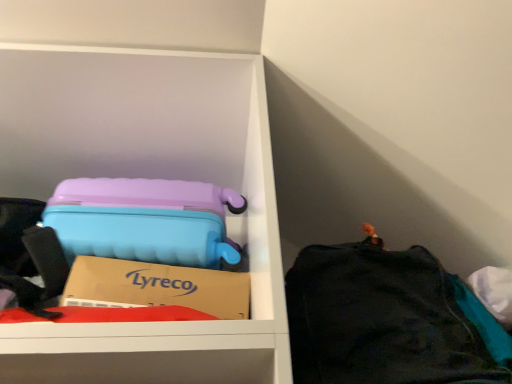
Question: Can you confirm if matte plastic suitcase at upper left is positioned to the left of black fabric bag at right?

Choices:
 (A) no
 (B) yes

Answer: (B)

Question: Is matte plastic suitcase at upper left thinner than black fabric bag at right?

Choices:
 (A) yes
 (B) no

Answer: (A)

Question: From a real-world perspective, is matte plastic suitcase at upper left on top of black fabric bag at right?

Choices:
 (A) yes
 (B) no

Answer: (A)

Question: From a real-world perspective, is matte plastic suitcase at upper left under black fabric bag at right?

Choices:
 (A) no
 (B) yes

Answer: (A)

Question: From the image's perspective, is matte plastic suitcase at upper left over black fabric bag at right?

Choices:
 (A) no
 (B) yes

Answer: (B)

Question: Considering the relative sizes of matte plastic suitcase at upper left and black fabric bag at right in the image provided, is matte plastic suitcase at upper left bigger than black fabric bag at right?

Choices:
 (A) yes
 (B) no

Answer: (A)

Question: Is black fabric bag at right not close to matte plastic suitcase at upper left?

Choices:
 (A) no
 (B) yes

Answer: (A)

Question: From a real-world perspective, is black fabric bag at right under matte plastic suitcase at upper left?

Choices:
 (A) no
 (B) yes

Answer: (B)

Question: Is black fabric bag at right facing towards matte plastic suitcase at upper left?

Choices:
 (A) yes
 (B) no

Answer: (B)

Question: From the image's perspective, is black fabric bag at right located beneath matte plastic suitcase at upper left?

Choices:
 (A) yes
 (B) no

Answer: (A)

Question: From the image's perspective, is black fabric bag at right above matte plastic suitcase at upper left?

Choices:
 (A) yes
 (B) no

Answer: (B)

Question: Is matte plastic suitcase at upper left inside black fabric bag at right?

Choices:
 (A) no
 (B) yes

Answer: (A)

Question: Based on their sizes in the image, would you say black fabric bag at right is bigger or smaller than matte plastic suitcase at upper left?

Choices:
 (A) big
 (B) small

Answer: (B)